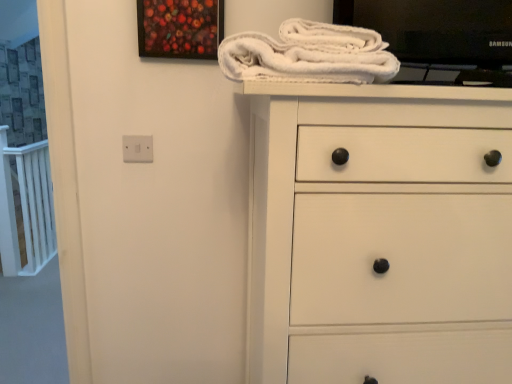
Question: From the image's perspective, relative to painted wood picture frame at upper center, is white fluffy bath towel at upper center above or below?

Choices:
 (A) below
 (B) above

Answer: (A)

Question: Considering the positions of point (266, 59) and point (150, 1), is point (266, 59) closer or farther from the camera than point (150, 1)?

Choices:
 (A) farther
 (B) closer

Answer: (B)

Question: Which object is the closest to the white fluffy bath towel at upper center?

Choices:
 (A) white matte chest of drawers at center
 (B) painted wood picture frame at upper center

Answer: (A)

Question: Estimate the real-world distances between objects in this image. Which object is closer to the white matte chest of drawers at center?

Choices:
 (A) white fluffy bath towel at upper center
 (B) painted wood picture frame at upper center

Answer: (A)